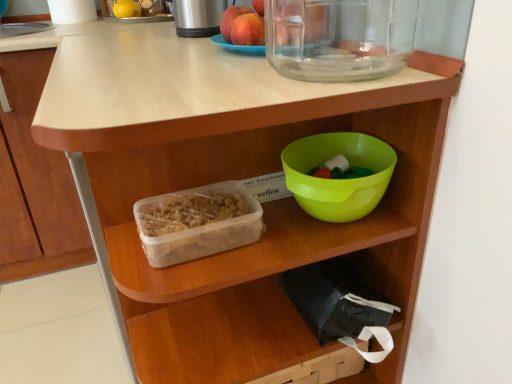
What do you see at coordinates (248, 30) in the screenshot?
I see `matte peach at upper center, the 1th apple positioned from the front` at bounding box center [248, 30].

Describe the element at coordinates (231, 19) in the screenshot. I see `smooth peach at upper center, the second apple positioned from the front` at that location.

Find the location of a particular element. Image resolution: width=512 pixels, height=384 pixels. green plastic bowl at center is located at coordinates (338, 179).

Image resolution: width=512 pixels, height=384 pixels. Find the location of `brushed metal thermos at upper center`. brushed metal thermos at upper center is located at coordinates tap(198, 17).

From a real-world perspective, is brushed metal thermos at upper center over smooth peach at upper center, acting as the first apple starting from the back?

Correct, in the physical world, brushed metal thermos at upper center is higher than smooth peach at upper center, acting as the first apple starting from the back.

Considering the sizes of objects brushed metal thermos at upper center and smooth peach at upper center, acting as the first apple starting from the back, in the image provided, who is bigger, brushed metal thermos at upper center or smooth peach at upper center, acting as the first apple starting from the back,?

Bigger between the two is brushed metal thermos at upper center.

Is brushed metal thermos at upper center directly adjacent to smooth peach at upper center, acting as the first apple starting from the back?

No, brushed metal thermos at upper center is not touching smooth peach at upper center, acting as the first apple starting from the back.

Is point (183, 10) positioned before point (227, 22)?

No, it is not.

From a real-world perspective, is green plastic bowl at center above or below smooth peach at upper center, the second apple positioned from the front?

green plastic bowl at center is situated lower than smooth peach at upper center, the second apple positioned from the front, in the real world.

How many degrees apart are the facing directions of green plastic bowl at center and smooth peach at upper center, acting as the first apple starting from the back?

The angle between the facing direction of green plastic bowl at center and the facing direction of smooth peach at upper center, acting as the first apple starting from the back, is 90.1 degrees.

Does point (324, 186) come in front of point (224, 32)?

Yes, it is in front of point (224, 32).

Which is correct: green plastic bowl at center is inside smooth peach at upper center, acting as the first apple starting from the back, or outside of it?

green plastic bowl at center is not enclosed by smooth peach at upper center, acting as the first apple starting from the back.

From a real-world perspective, is translucent plastic container at center over green plastic bowl at center?

Incorrect, from a real-world perspective, translucent plastic container at center is lower than green plastic bowl at center.

Which object is positioned more to the right, translucent plastic container at center or green plastic bowl at center?

green plastic bowl at center.

Do you think translucent plastic container at center is within green plastic bowl at center, or outside of it?

translucent plastic container at center is outside green plastic bowl at center.

Is translucent plastic container at center closer to camera compared to green plastic bowl at center?

Yes, it is in front of green plastic bowl at center.

Is matte peach at upper center, the 2th apple in the back-to-front sequence, inside the boundaries of green plastic bowl at center, or outside?

matte peach at upper center, the 2th apple in the back-to-front sequence, cannot be found inside green plastic bowl at center.

Who is bigger, matte peach at upper center, the 2th apple in the back-to-front sequence, or green plastic bowl at center?

With larger size is green plastic bowl at center.

Is green plastic bowl at center placed right next to translucent plastic container at center?

No, green plastic bowl at center is not beside translucent plastic container at center.

From a real-world perspective, is green plastic bowl at center physically located above or below translucent plastic container at center?

green plastic bowl at center is situated higher than translucent plastic container at center in the real world.

Considering the sizes of objects green plastic bowl at center and translucent plastic container at center in the image provided, who is bigger, green plastic bowl at center or translucent plastic container at center?

With larger size is green plastic bowl at center.

Is green plastic bowl at center inside the boundaries of translucent plastic container at center, or outside?

green plastic bowl at center is outside translucent plastic container at center.

In order to click on the 1st apple to the right of the brushed metal thermos at upper center, starting your count from the anchor in this screenshot , I will do `click(231, 19)`.

Is smooth peach at upper center, the second apple positioned from the front, positioned beyond the bounds of brushed metal thermos at upper center?

Yes, smooth peach at upper center, the second apple positioned from the front, is not within brushed metal thermos at upper center.

Looking at this image, is smooth peach at upper center, the second apple positioned from the front, to the left of brushed metal thermos at upper center from the viewer's perspective?

In fact, smooth peach at upper center, the second apple positioned from the front, is to the right of brushed metal thermos at upper center.

From the image's perspective, is brushed metal thermos at upper center located beneath green plastic bowl at center?

Incorrect, from the image's perspective, brushed metal thermos at upper center is higher than green plastic bowl at center.

Does brushed metal thermos at upper center lie in front of green plastic bowl at center?

That is False.

Considering the positions of objects brushed metal thermos at upper center and green plastic bowl at center in the image provided, who is more to the left, brushed metal thermos at upper center or green plastic bowl at center?

From the viewer's perspective, brushed metal thermos at upper center appears more on the left side.

Is brushed metal thermos at upper center smaller than green plastic bowl at center?

No, brushed metal thermos at upper center is not smaller than green plastic bowl at center.

Starting from the brushed metal thermos at upper center, which apple is the 1st one in front? Please provide its 2D coordinates.

[(231, 19)]

At what (x,y) coordinates should I click in order to perform the action: click on the 2nd apple to the left when counting from the green plastic bowl at center. Please return your answer as a coordinate pair (x, y). This screenshot has width=512, height=384. Looking at the image, I should click on (231, 19).

Looking at the image, which one is located closer to translucent plastic container at center, brushed metal thermos at upper center or smooth peach at upper center, the second apple positioned from the front?

Among the two, smooth peach at upper center, the second apple positioned from the front, is located nearer to translucent plastic container at center.

From the image, which object appears to be nearer to brushed metal thermos at upper center, smooth peach at upper center, the second apple positioned from the front, or translucent plastic container at center?

Among the two, smooth peach at upper center, the second apple positioned from the front, is located nearer to brushed metal thermos at upper center.

From the image, which object appears to be nearer to green plastic bowl at center, smooth peach at upper center, acting as the first apple starting from the back, or translucent plastic container at center?

Based on the image, translucent plastic container at center appears to be nearer to green plastic bowl at center.

Estimate the real-world distances between objects in this image. Which object is closer to brushed metal thermos at upper center, translucent plastic container at center or smooth peach at upper center, the second apple positioned from the front?

smooth peach at upper center, the second apple positioned from the front, lies closer to brushed metal thermos at upper center than the other object.

Estimate the real-world distances between objects in this image. Which object is closer to green plastic bowl at center, translucent plastic container at center or brushed metal thermos at upper center?

translucent plastic container at center lies closer to green plastic bowl at center than the other object.

From the image, which object appears to be farther from green plastic bowl at center, matte peach at upper center, the 2th apple in the back-to-front sequence, or translucent plastic container at center?

Among the two, matte peach at upper center, the 2th apple in the back-to-front sequence, is located further to green plastic bowl at center.

When comparing their distances from green plastic bowl at center, does matte peach at upper center, the 1th apple positioned from the front, or brushed metal thermos at upper center seem further?

brushed metal thermos at upper center lies further to green plastic bowl at center than the other object.

Based on their spatial positions, is translucent plastic container at center or smooth peach at upper center, acting as the first apple starting from the back, closer to green plastic bowl at center?

translucent plastic container at center is closer to green plastic bowl at center.

At what (x,y) coordinates should I click in order to perform the action: click on apple between smooth peach at upper center, the second apple positioned from the front, and green plastic bowl at center in the up-down direction. Please return your answer as a coordinate pair (x, y). Image resolution: width=512 pixels, height=384 pixels. Looking at the image, I should click on (248, 30).

The width and height of the screenshot is (512, 384). Find the location of `apple between smooth peach at upper center, acting as the first apple starting from the back, and translucent plastic container at center vertically`. apple between smooth peach at upper center, acting as the first apple starting from the back, and translucent plastic container at center vertically is located at coordinates (248, 30).

Find the location of a particular element. bowl between smooth peach at upper center, the second apple positioned from the front, and translucent plastic container at center in the up-down direction is located at coordinates (338, 179).

Locate an element on the screen. The height and width of the screenshot is (384, 512). bowl between matte peach at upper center, the 1th apple positioned from the front, and translucent plastic container at center, in the vertical direction is located at coordinates (338, 179).